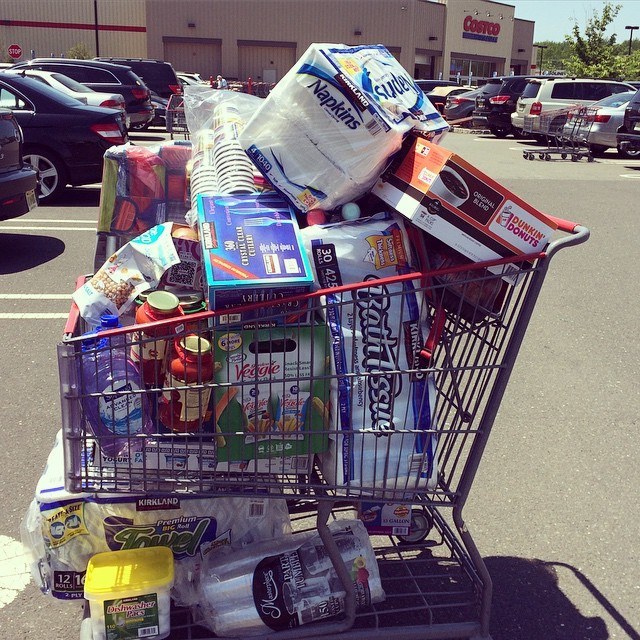
The height and width of the screenshot is (640, 640). Identify the location of napkins. (324, 102).